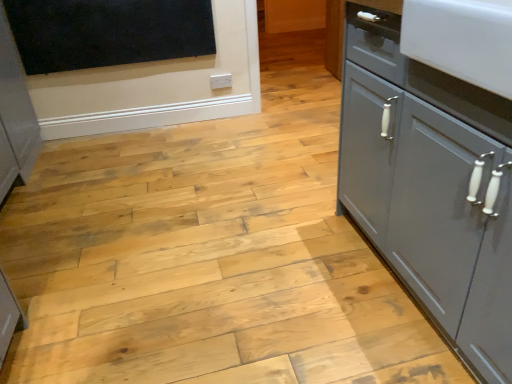
What do you see at coordinates (431, 186) in the screenshot?
I see `matte gray cabinet at right` at bounding box center [431, 186].

This screenshot has height=384, width=512. In order to click on matte gray cabinet at right in this screenshot , I will do `click(431, 186)`.

Where is `black matte board at upper left`? black matte board at upper left is located at coordinates (106, 32).

This screenshot has height=384, width=512. What do you see at coordinates (106, 32) in the screenshot?
I see `black matte board at upper left` at bounding box center [106, 32].

This screenshot has width=512, height=384. I want to click on matte gray cabinet at right, so click(x=431, y=186).

Does black matte board at upper left appear on the left side of matte gray cabinet at right?

Indeed, black matte board at upper left is positioned on the left side of matte gray cabinet at right.

From the picture: Which object is further away from the camera, black matte board at upper left or matte gray cabinet at right?

Positioned behind is black matte board at upper left.

Is point (97, 54) positioned after point (422, 167)?

Yes, point (97, 54) is farther from viewer.

From the image's perspective, which is below, black matte board at upper left or matte gray cabinet at right?

matte gray cabinet at right appears lower in the image.

From a real-world perspective, who is located higher, black matte board at upper left or matte gray cabinet at right?

black matte board at upper left, from a real-world perspective.

Does black matte board at upper left have a lesser width compared to matte gray cabinet at right?

Indeed, black matte board at upper left has a lesser width compared to matte gray cabinet at right.

Considering the relative sizes of black matte board at upper left and matte gray cabinet at right in the image provided, is black matte board at upper left taller than matte gray cabinet at right?

Incorrect, the height of black matte board at upper left is not larger of that of matte gray cabinet at right.

Between black matte board at upper left and matte gray cabinet at right, which one has larger size?

With larger size is matte gray cabinet at right.

Is black matte board at upper left positioned beyond the bounds of matte gray cabinet at right?

Yes, black matte board at upper left is outside of matte gray cabinet at right.

Is black matte board at upper left directly adjacent to matte gray cabinet at right?

black matte board at upper left and matte gray cabinet at right are clearly separated.

Is matte gray cabinet at right at the back of black matte board at upper left?

No, matte gray cabinet at right is not at the back of black matte board at upper left.

How many degrees apart are the facing directions of black matte board at upper left and matte gray cabinet at right?

The angular difference between black matte board at upper left and matte gray cabinet at right is 90 degrees.

This screenshot has height=384, width=512. What are the coordinates of `cupboard in front of the black matte board at upper left` in the screenshot? It's located at (431, 186).

In the image, is matte gray cabinet at right on the left side or the right side of black matte board at upper left?

→ Clearly, matte gray cabinet at right is on the right of black matte board at upper left in the image.

Considering their positions, is matte gray cabinet at right located in front of or behind black matte board at upper left?

Visually, matte gray cabinet at right is located in front of black matte board at upper left.

Between point (419, 246) and point (151, 56), which one is positioned in front?

Point (419, 246)

From the image's perspective, between matte gray cabinet at right and black matte board at upper left, which one is located above?

black matte board at upper left appears higher in the image.

From a real-world perspective, which object rests below the other?

matte gray cabinet at right is physically lower.

Which of these two, matte gray cabinet at right or black matte board at upper left, is wider?

matte gray cabinet at right is wider.

In terms of height, does matte gray cabinet at right look taller or shorter compared to black matte board at upper left?

Considering their sizes, matte gray cabinet at right has more height than black matte board at upper left.

Considering the relative sizes of matte gray cabinet at right and black matte board at upper left in the image provided, is matte gray cabinet at right bigger than black matte board at upper left?

Correct, matte gray cabinet at right is larger in size than black matte board at upper left.

Is matte gray cabinet at right surrounding black matte board at upper left?

Definitely not — black matte board at upper left is not inside matte gray cabinet at right.

Is there a large distance between matte gray cabinet at right and black matte board at upper left?

matte gray cabinet at right is far away from black matte board at upper left.

Is matte gray cabinet at right aimed at black matte board at upper left?

No, matte gray cabinet at right does not turn towards black matte board at upper left.

Measure the distance from matte gray cabinet at right to black matte board at upper left.

matte gray cabinet at right and black matte board at upper left are 1.95 meters apart.

You are a GUI agent. You are given a task and a screenshot of the screen. Output one action in this format:
    pyautogui.click(x=<x>, y=<y>)
    Task: Click on the cupboard located in front of the black matte board at upper left
    
    Given the screenshot: What is the action you would take?
    pyautogui.click(x=431, y=186)

Image resolution: width=512 pixels, height=384 pixels. In order to click on dark above the matte gray cabinet at right (from the image's perspective) in this screenshot , I will do `click(106, 32)`.

Where is `cupboard below the black matte board at upper left (from a real-world perspective)`? cupboard below the black matte board at upper left (from a real-world perspective) is located at coordinates (431, 186).